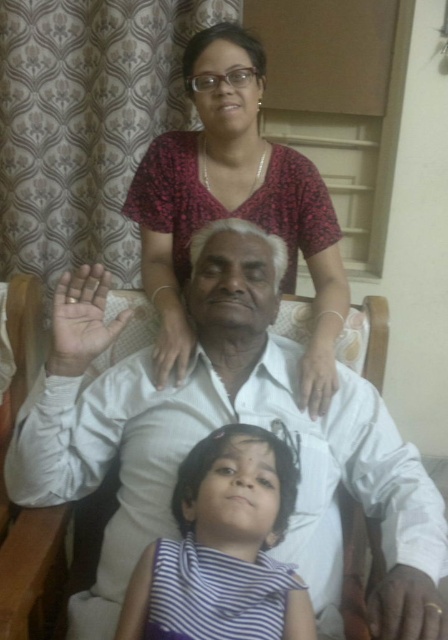
You are a photographer setting up for a family portrait. You notice the white smooth shirt at center and the matte floral blouse at upper center. Which clothing item is positioned lower in the image?

The white smooth shirt at center is located below the matte floral blouse at upper center, so it is positioned lower in the image.

You are a photographer standing in front of the scene. You want to take a closeup photo of the white smooth shirt at center. The camera you have can focus on objects within 30 inches. Can you take the photo without moving closer?

The white smooth shirt at center is 30.95 inches from the viewer. Since the camera can focus within 30 inches, the distance is slightly beyond the camera range. Move closer to ensure proper focus.

You are an interior designer assessing the layout of this living room. You notice the matte floral blouse at upper center and the striped fabric at lower center. Which object is positioned higher in the image?

The matte floral blouse at upper center is positioned higher in the image compared to the striped fabric at lower center, as it has a greater height.